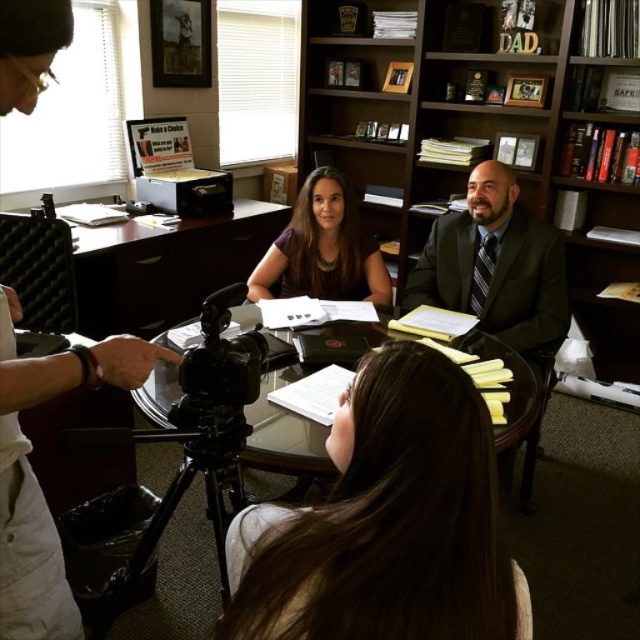
Question: Is dark suit at center positioned at the back of smooth brown hair at center?

Choices:
 (A) yes
 (B) no

Answer: (B)

Question: Which of these objects is positioned closest to the wooden bookshelf at upper center?

Choices:
 (A) brown hair at center
 (B) transparent glass table at center

Answer: (B)

Question: Which point is farther to the camera?

Choices:
 (A) (419, 76)
 (B) (294, 211)

Answer: (A)

Question: Among these points, which one is farthest from the camera?

Choices:
 (A) (346, 259)
 (B) (412, 186)

Answer: (B)

Question: Does white plastic camera at left come in front of transparent glass table at center?

Choices:
 (A) yes
 (B) no

Answer: (A)

Question: Considering the relative positions of wooden bookshelf at upper center and dark suit at center in the image provided, where is wooden bookshelf at upper center located with respect to dark suit at center?

Choices:
 (A) right
 (B) left

Answer: (A)